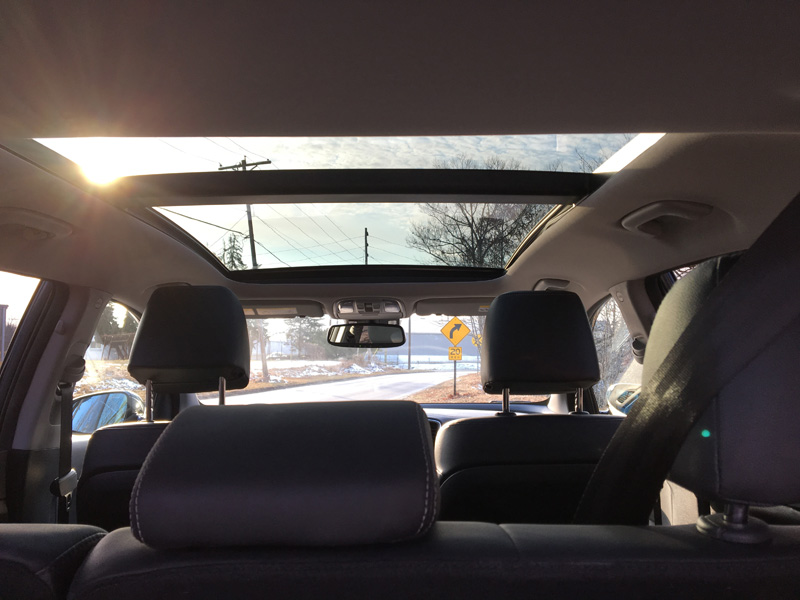
Locate an element on the screen. head rest is located at coordinates coord(206,319), coord(546,337), coord(749,422), coord(210,488).